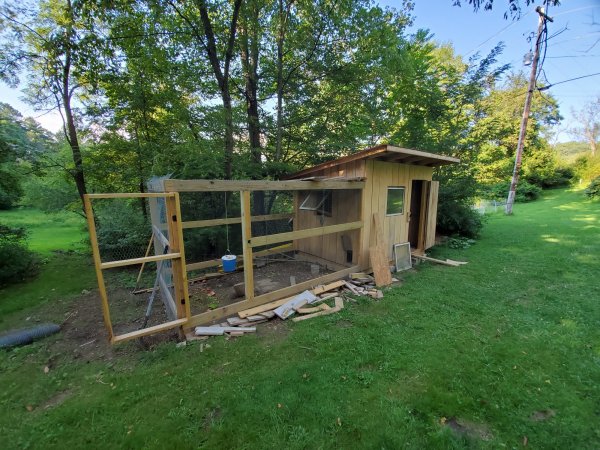
You are a GUI agent. You are given a task and a screenshot of the screen. Output one action in this format:
    pyautogui.click(x=<x>, y=<y>)
    Task: Click on the 1 window screen on the ground
    
    Given the screenshot: What is the action you would take?
    pyautogui.click(x=405, y=252)